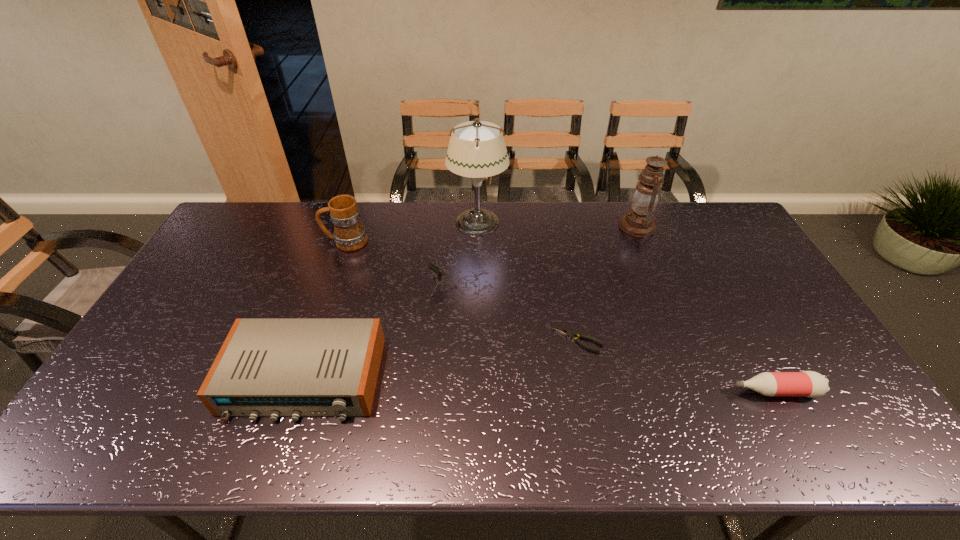
At what (x,y) coordinates should I click in order to perform the action: click on free area in between the second tallest object and the third tallest object. Please return your answer as a coordinate pair (x, y). The height and width of the screenshot is (540, 960). Looking at the image, I should click on (492, 234).

Locate an element on the screen. free point between the radio receiver and the mug is located at coordinates (324, 310).

Where is `blank region between the pliers and the lampshade`? The width and height of the screenshot is (960, 540). blank region between the pliers and the lampshade is located at coordinates (527, 281).

Where is `vacant space that's between the fourth farthest object and the lampshade`? vacant space that's between the fourth farthest object and the lampshade is located at coordinates (466, 255).

At what (x,y) coordinates should I click in order to perform the action: click on empty location between the tallest object and the second shortest object. Please return your answer as a coordinate pair (x, y). The height and width of the screenshot is (540, 960). Looking at the image, I should click on (626, 307).

Image resolution: width=960 pixels, height=540 pixels. Find the location of `free point between the second shortest object and the fourth farthest object`. free point between the second shortest object and the fourth farthest object is located at coordinates (614, 339).

Locate an element on the screen. empty space between the tallest object and the bottle is located at coordinates (626, 307).

Where is `vacant point located between the second tallest object and the fifth shortest object`? This screenshot has width=960, height=540. vacant point located between the second tallest object and the fifth shortest object is located at coordinates point(492,234).

Identify which object is the fifth closest to the sixth tallest object. Please provide its 2D coordinates. Your answer should be formatted as a tuple, i.e. [(x, y)], where the tuple contains the x and y coordinates of a point satisfying the conditions above.

[(266, 367)]

Identify the location of object that can be found as the third closest to the sixth tallest object. The image size is (960, 540). (431, 266).